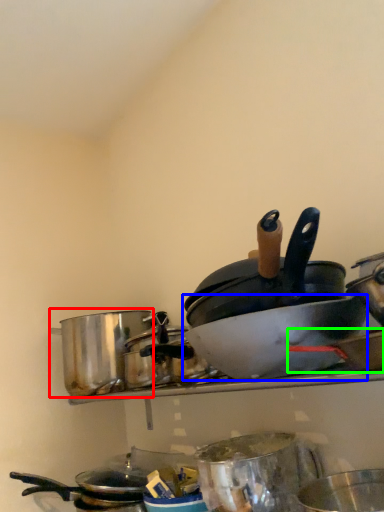
Question: Which object is the farthest from crock pot (highlighted by a red box)? Choose among these: basin (highlighted by a blue box) or wok (highlighted by a green box).

Choices:
 (A) basin
 (B) wok

Answer: (B)